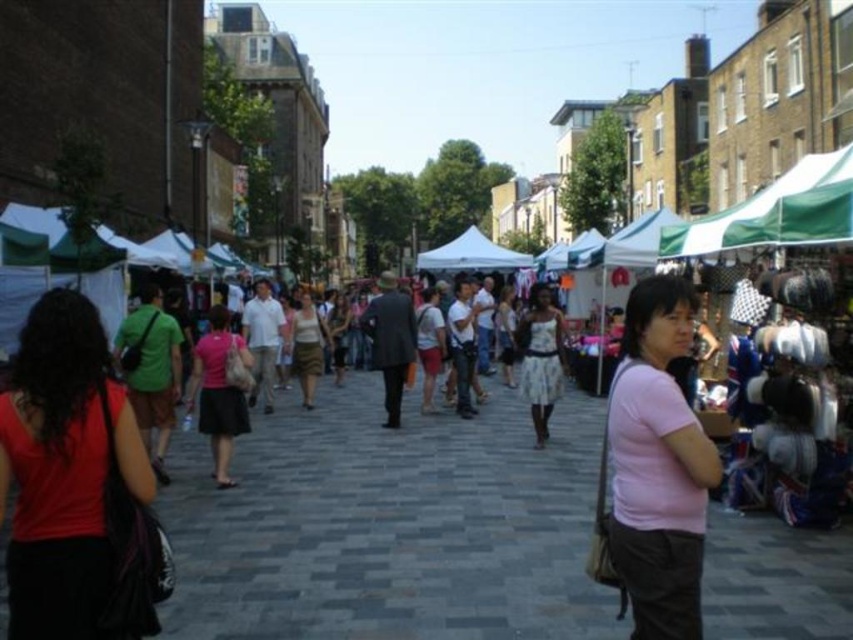
You are a vendor at the market and need to fold the pink fabric skirt at center and the matte gray coat at center to store them. Which item requires a larger storage space due to its size?

The pink fabric skirt at center requires a larger storage space because its width is greater than that of the matte gray coat at center.

You are a customer at the market and want to buy both the pink fabric skirt at center and the matte gray coat at center. Which item should you visit first if you are standing on the right side of the street?

The pink fabric skirt at center is to the left of the matte gray coat at center. Since you are standing on the right side of the street, you should visit the pink fabric skirt at center first as it is closer to your current position.